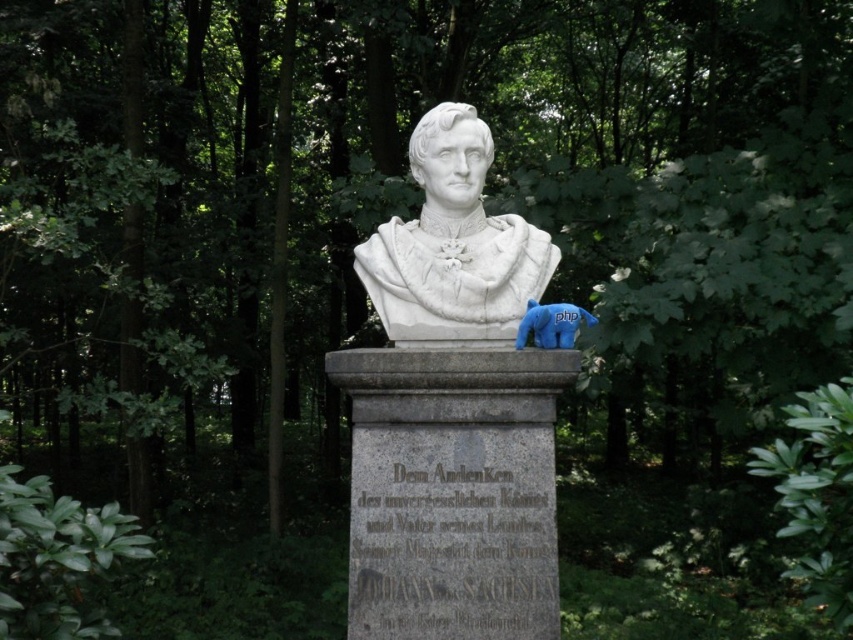
Question: Is white marble bust at center above blue plush bear at center?

Choices:
 (A) no
 (B) yes

Answer: (B)

Question: Which object is farther from the camera taking this photo?

Choices:
 (A) white marble bust at center
 (B) blue plush bear at center

Answer: (A)

Question: Does white marble bust at center appear on the left side of blue plush bear at center?

Choices:
 (A) no
 (B) yes

Answer: (B)

Question: Is white marble bust at center further to the viewer compared to blue plush bear at center?

Choices:
 (A) no
 (B) yes

Answer: (B)

Question: Which object appears farthest from the camera in this image?

Choices:
 (A) blue plush bear at center
 (B) white marble bust at center

Answer: (B)

Question: Which of the following is the farthest from the observer?

Choices:
 (A) (537, 304)
 (B) (526, 284)

Answer: (B)